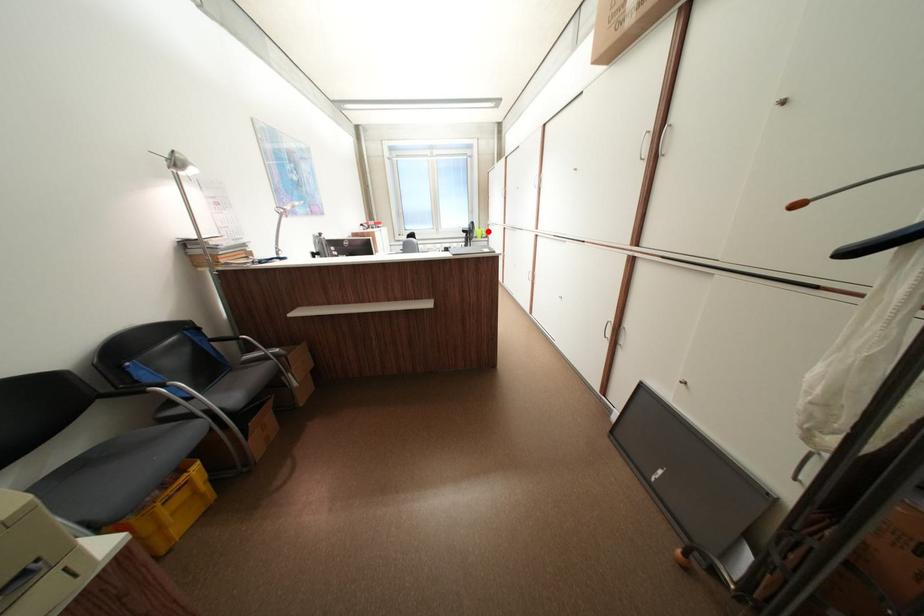
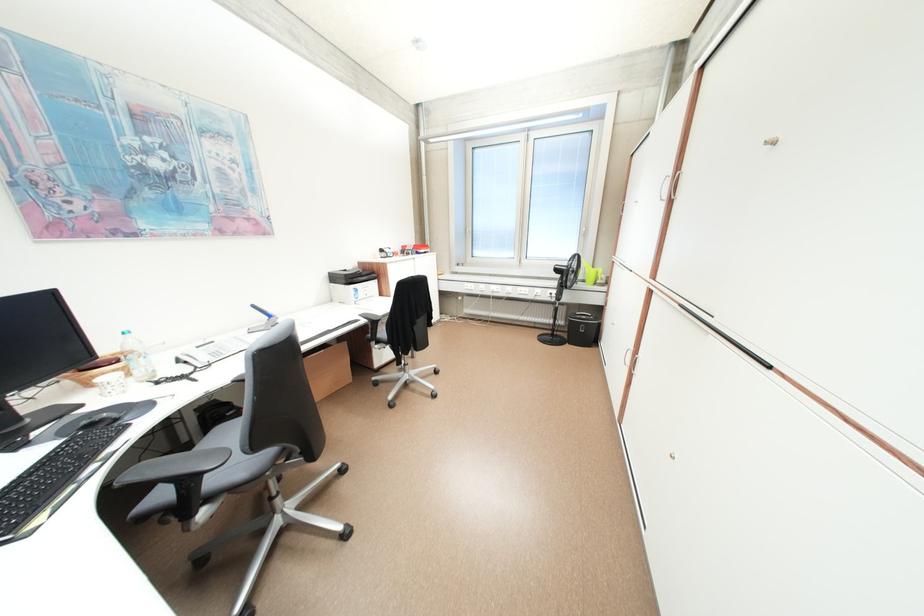
Question: A red point is marked in image1. In image2, is the corresponding 3D point closer to the camera or farther? Reply with the corresponding letter.

Choices:
 (A) The corresponding 3D point is closer.
 (B) The corresponding 3D point is farther.

Answer: (B)